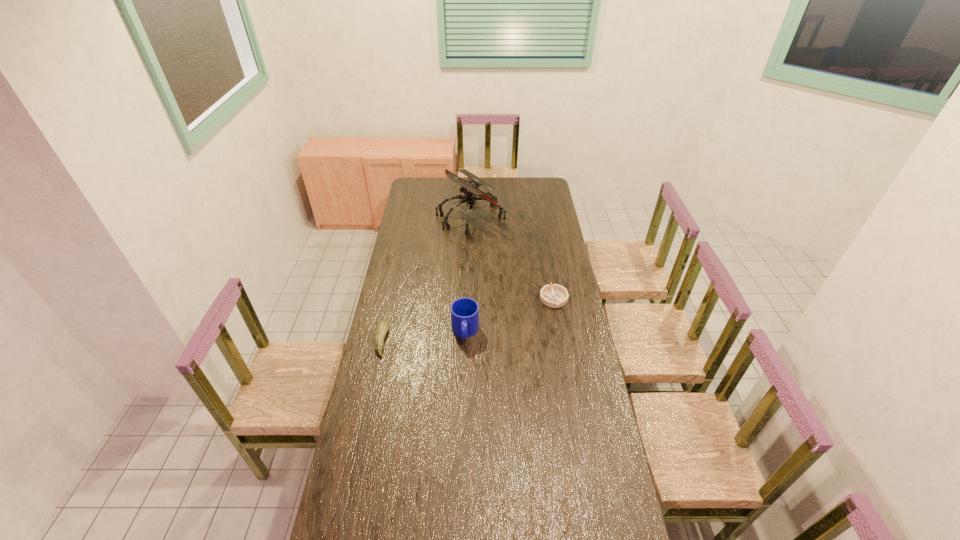
Where is `free spot located 0.120m on the front of the ashtray`? Image resolution: width=960 pixels, height=540 pixels. free spot located 0.120m on the front of the ashtray is located at coordinates (559, 328).

Image resolution: width=960 pixels, height=540 pixels. Find the location of `object at the left edge`. object at the left edge is located at coordinates (382, 327).

This screenshot has width=960, height=540. I want to click on object that is at the right edge, so tap(555, 296).

In the image, there is a desktop. In order to click on vacant space at the far edge in this screenshot , I will do `click(440, 185)`.

In order to click on free space at the left edge in this screenshot , I will do `click(413, 284)`.

In the image, there is a desktop. Identify the location of vacant region at the right edge. This screenshot has height=540, width=960. (530, 201).

The height and width of the screenshot is (540, 960). I want to click on free space that is in between the tallest object and the second farthest object, so click(512, 258).

Locate an element on the screen. This screenshot has width=960, height=540. vacant area that lies between the third shortest object and the tallest object is located at coordinates (468, 274).

Identify the location of vacant space in between the second shortest object and the tallest object. This screenshot has width=960, height=540. (426, 279).

Identify the location of empty space between the mug and the ashtray. The width and height of the screenshot is (960, 540). (510, 315).